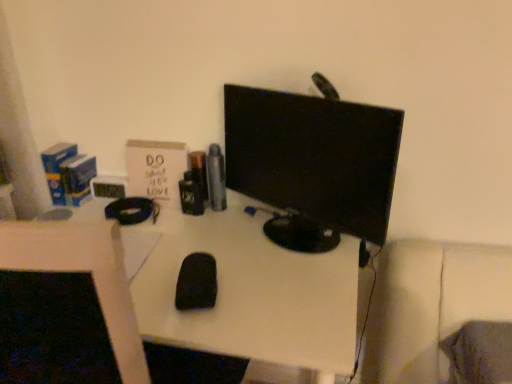
The width and height of the screenshot is (512, 384). What are the coordinates of `free space to the left of black glossy monitor at center` in the screenshot? It's located at (204, 246).